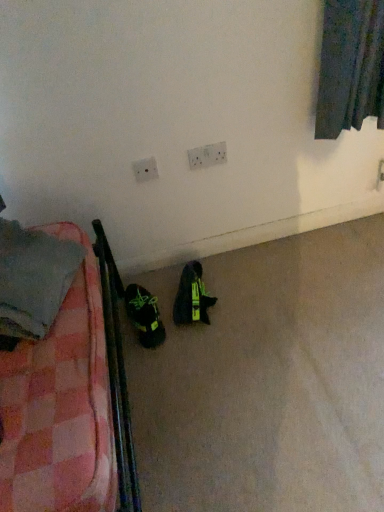
The width and height of the screenshot is (384, 512). In order to click on vacant area to the right of green synthetic shoe at center, which appears as the second footwear when viewed from the left in this screenshot , I will do `click(235, 288)`.